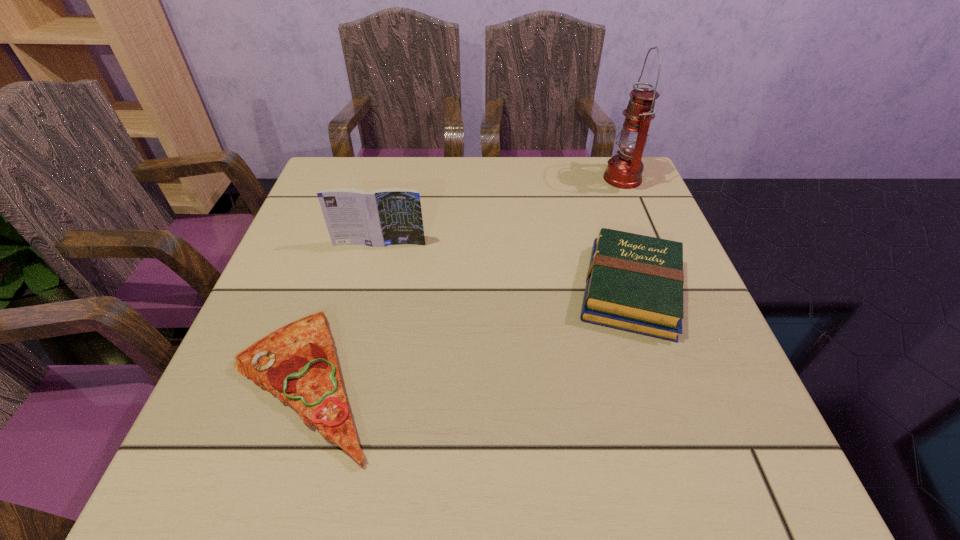
This screenshot has height=540, width=960. I want to click on vacant space at the near edge of the desktop, so click(661, 457).

In the image, there is a desktop. Where is `vacant region at the left edge`? The image size is (960, 540). vacant region at the left edge is located at coordinates (276, 434).

The height and width of the screenshot is (540, 960). Identify the location of free space at the right edge of the desktop. (717, 372).

Locate an element on the screen. vacant space at the far left corner is located at coordinates (335, 188).

Image resolution: width=960 pixels, height=540 pixels. In order to click on vacant space at the near left corner of the desktop in this screenshot , I will do `click(252, 482)`.

Where is `free region at the far right corner`? The image size is (960, 540). free region at the far right corner is located at coordinates (591, 177).

Find the location of a particular element. This screenshot has height=540, width=960. vacant space that's between the shorter book and the shortest object is located at coordinates (468, 336).

The image size is (960, 540). I want to click on vacant space that's between the right book and the pizza, so click(468, 336).

I want to click on blank region between the farthest object and the third shortest object, so click(x=501, y=211).

Image resolution: width=960 pixels, height=540 pixels. Identify the location of free space between the farthest object and the pizza. (464, 280).